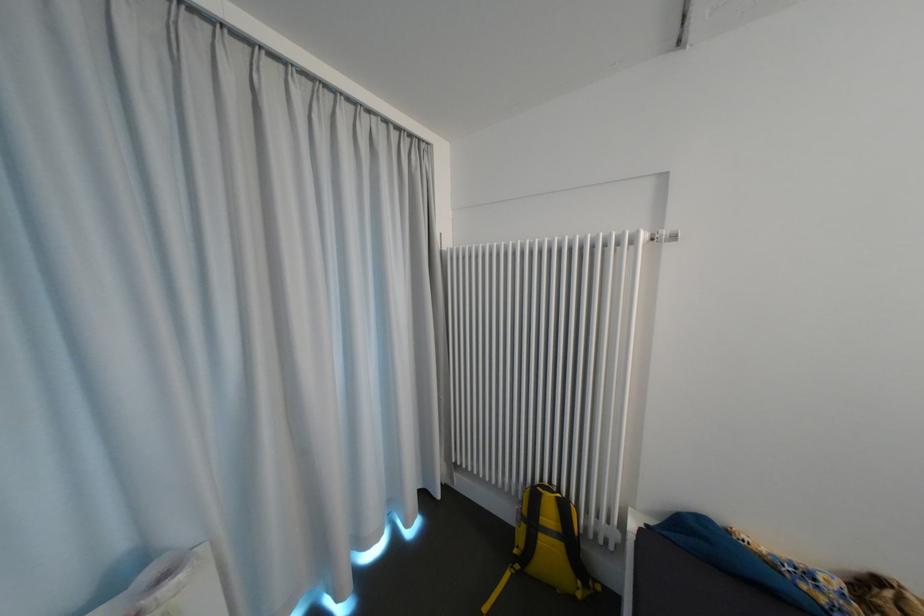
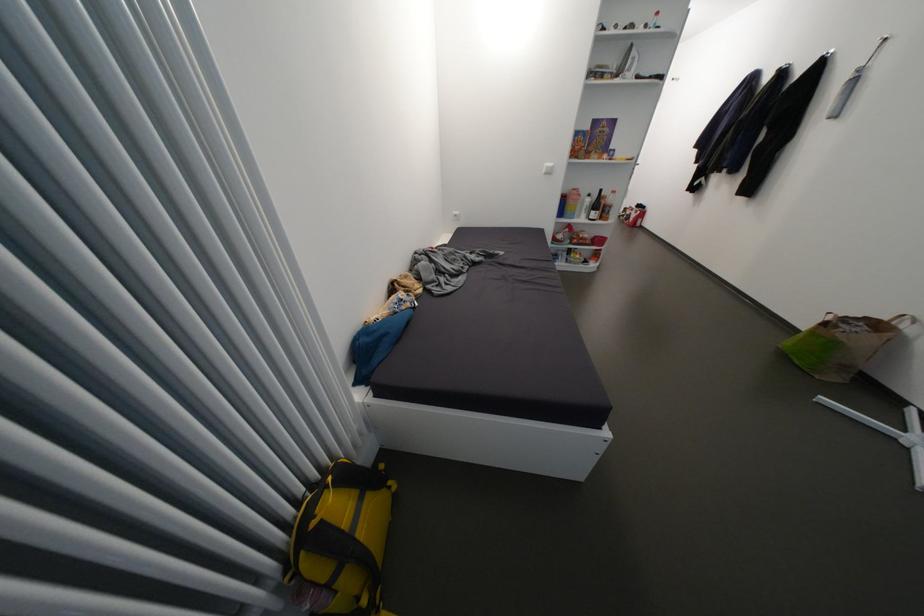
In the second image, find the point that corresponds to point 551,541 in the first image.

(370, 533)